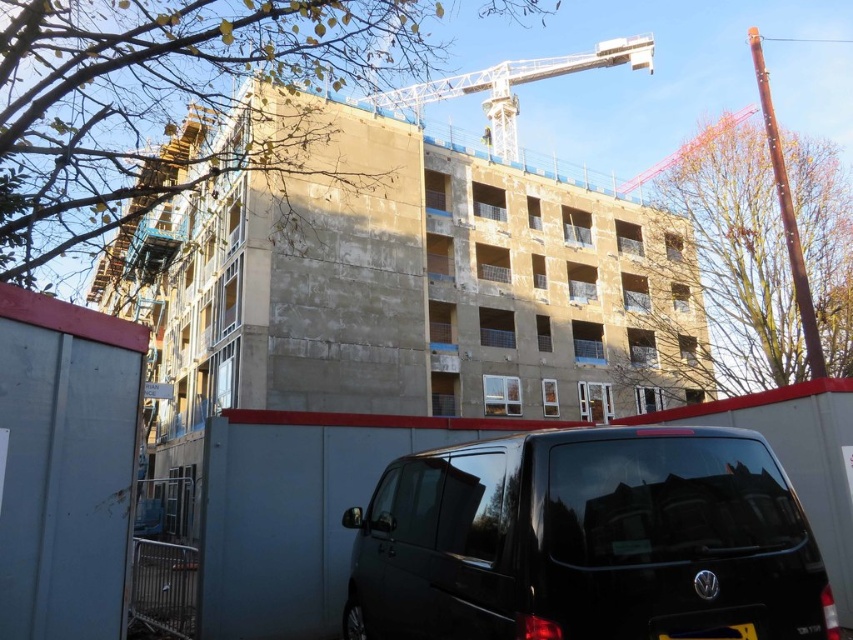
You are a delivery driver arriving at the construction site. You need to drive your truck through the path between the black matte van at lower center and the white metallic crane at upper center. Can you pass through without hitting either object?

The black matte van at lower center is in front of the white metallic crane at upper center, meaning the van is closer to you. Since the van is blocking the path to the crane, you cannot drive through the space between them as the van is directly in front, leaving no lateral space between the two objects for your truck to pass.

You are standing at the point marked by the coordinate point at (585,540). What object is located at that coordinate?

The point at (585,540) marks the location of the black matte van at lower center.

You are standing at the point with coordinates (585,540) in the construction site image. What object are you most likely standing on or near?

You are most likely standing on or near the black matte van at lower center, as the coordinates point (585,540) corresponds to that object.